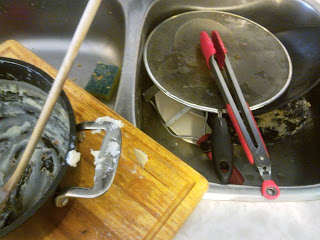
Locate an element on the screen. Image resolution: width=320 pixels, height=240 pixels. scrubber sponge is located at coordinates (102, 80).